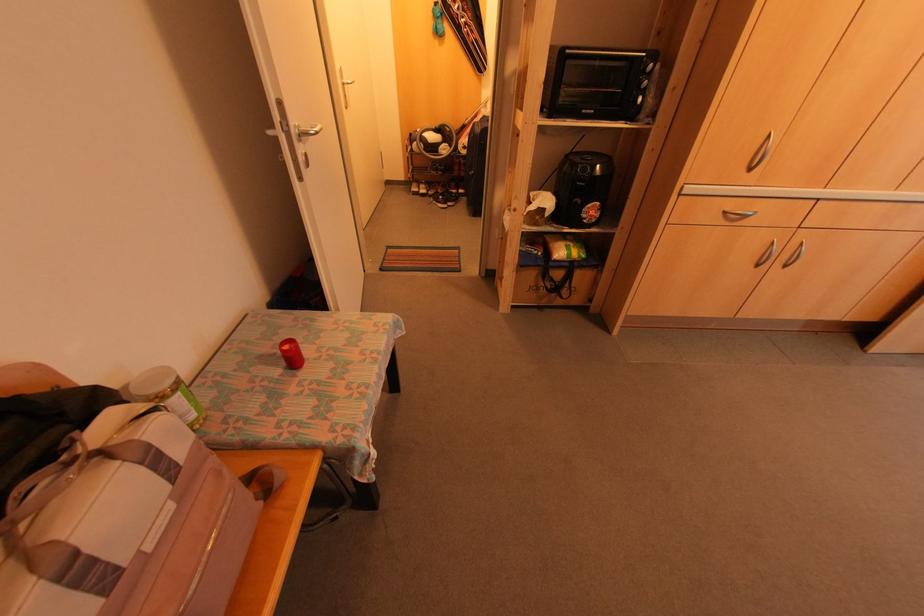
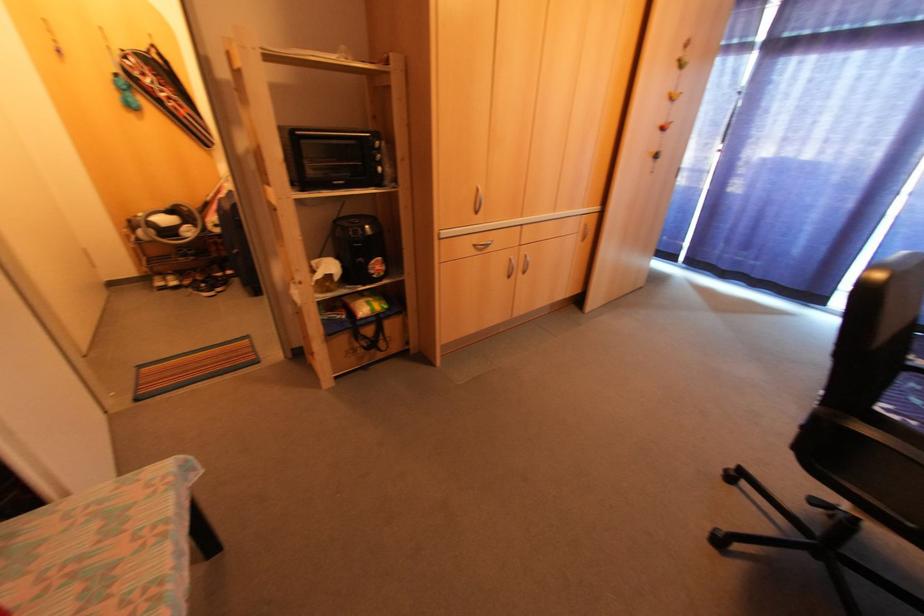
Find the pixel in the second image that matches (567,254) in the first image.

(370, 309)